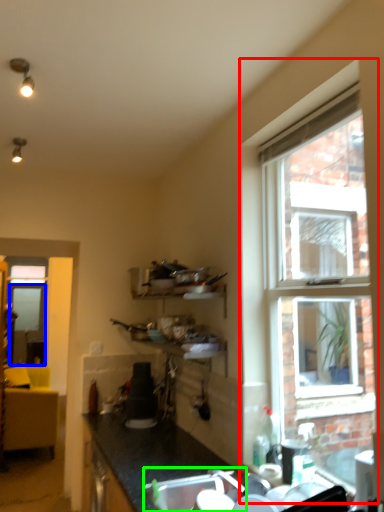
Question: Estimate the real-world distances between objects in this image. Which object is closer to window (highlighted by a red box), screen door (highlighted by a blue box) or sink (highlighted by a green box)?

Choices:
 (A) screen door
 (B) sink

Answer: (B)